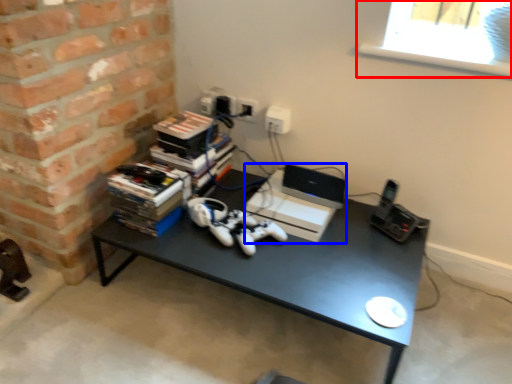
Question: Which of the following is the closest to the observer, window screen (highlighted by a red box) or computer (highlighted by a blue box)?

Choices:
 (A) window screen
 (B) computer

Answer: (A)